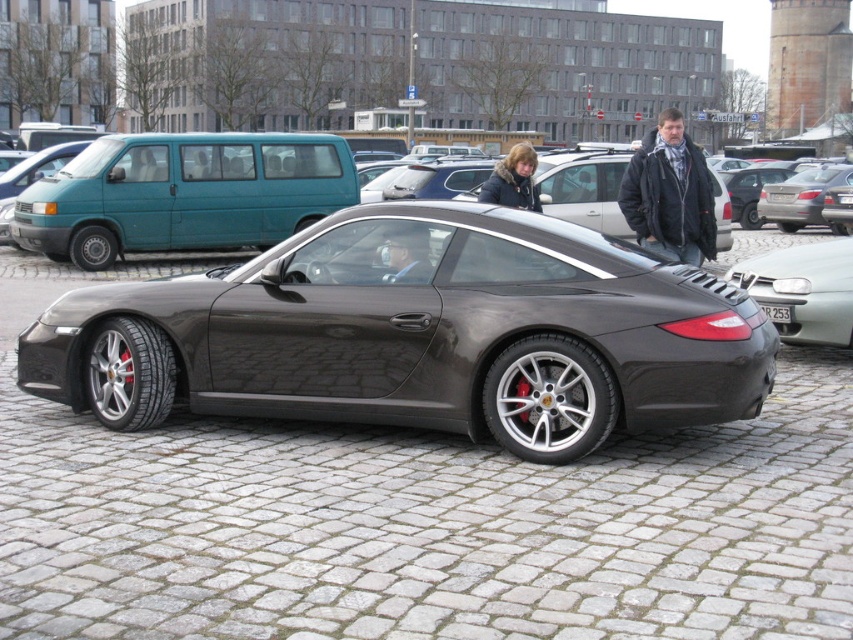
Between dark brown leather jacket at upper center and black plastic license plate at center, which one is positioned higher?

dark brown leather jacket at upper center is above.

Can you confirm if dark brown leather jacket at upper center is taller than black plastic license plate at center?

Correct, dark brown leather jacket at upper center is much taller as black plastic license plate at center.

Where is `dark brown leather jacket at upper center`? Image resolution: width=853 pixels, height=640 pixels. dark brown leather jacket at upper center is located at coordinates (514, 180).

Does white plastic license plate at center have a lesser width compared to black plastic license plate at center?

Yes.

Can you confirm if white plastic license plate at center is positioned above black plastic license plate at center?

Incorrect, white plastic license plate at center is not positioned above black plastic license plate at center.

Does point (780, 314) come behind point (785, 202)?

That is False.

The height and width of the screenshot is (640, 853). Find the location of `white plastic license plate at center`. white plastic license plate at center is located at coordinates (776, 314).

Between dark gray leather jacket at upper right and dark brown leather jacket at upper center, which one appears on the left side from the viewer's perspective?

Positioned to the left is dark gray leather jacket at upper right.

Which of these two, dark gray leather jacket at upper right or dark brown leather jacket at upper center, stands shorter?

With less height is dark gray leather jacket at upper right.

What do you see at coordinates (670, 193) in the screenshot?
I see `dark gray leather jacket at upper right` at bounding box center [670, 193].

Locate an element on the screen. dark gray leather jacket at upper right is located at coordinates (670, 193).